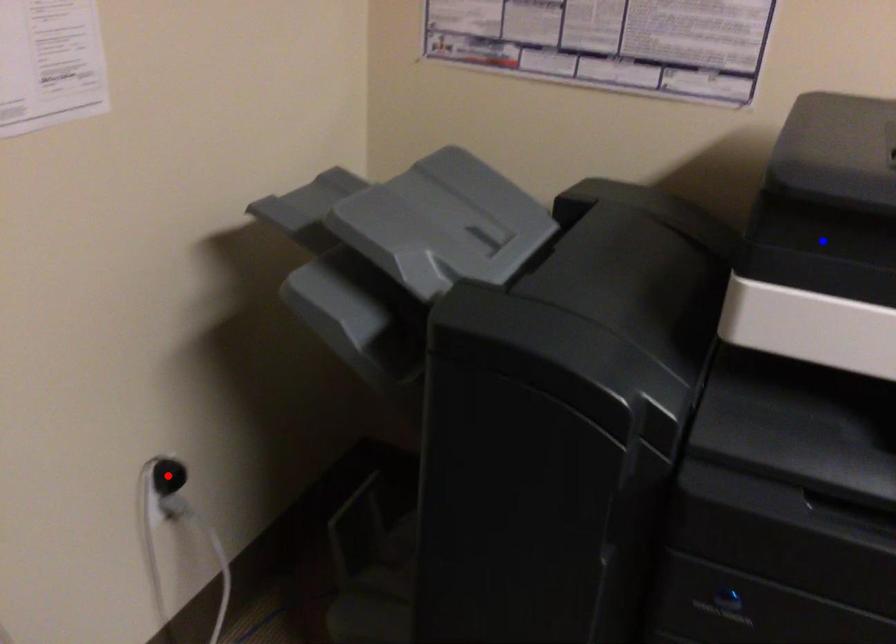
Question: Which of the two points in the image is closer to the camera?

Choices:
 (A) Blue point is closer.
 (B) Red point is closer.

Answer: (A)